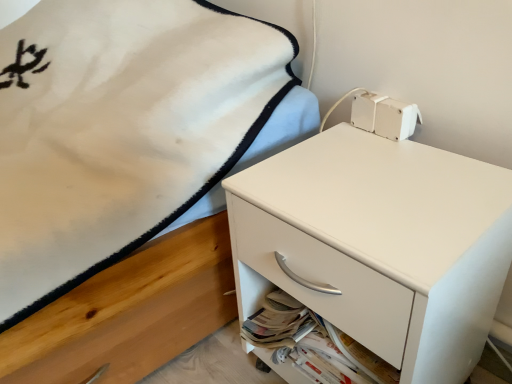
Question: From the image's perspective, relative to white matte drawer at lower right, is white matte chest of drawers at center above or below?

Choices:
 (A) above
 (B) below

Answer: (A)

Question: Considering the positions of white matte chest of drawers at center and white matte drawer at lower right in the image, is white matte chest of drawers at center wider or thinner than white matte drawer at lower right?

Choices:
 (A) thin
 (B) wide

Answer: (B)

Question: From a real-world perspective, is white matte chest of drawers at center positioned above or below white matte drawer at lower right?

Choices:
 (A) below
 (B) above

Answer: (B)

Question: From the image's perspective, is white matte drawer at lower right positioned above or below white matte chest of drawers at center?

Choices:
 (A) above
 (B) below

Answer: (B)

Question: Is point (307, 297) closer or farther from the camera than point (394, 142)?

Choices:
 (A) farther
 (B) closer

Answer: (B)

Question: From their relative heights in the image, would you say white matte drawer at lower right is taller or shorter than white matte chest of drawers at center?

Choices:
 (A) short
 (B) tall

Answer: (A)

Question: Which is correct: white matte drawer at lower right is inside white matte chest of drawers at center, or outside of it?

Choices:
 (A) inside
 (B) outside

Answer: (A)